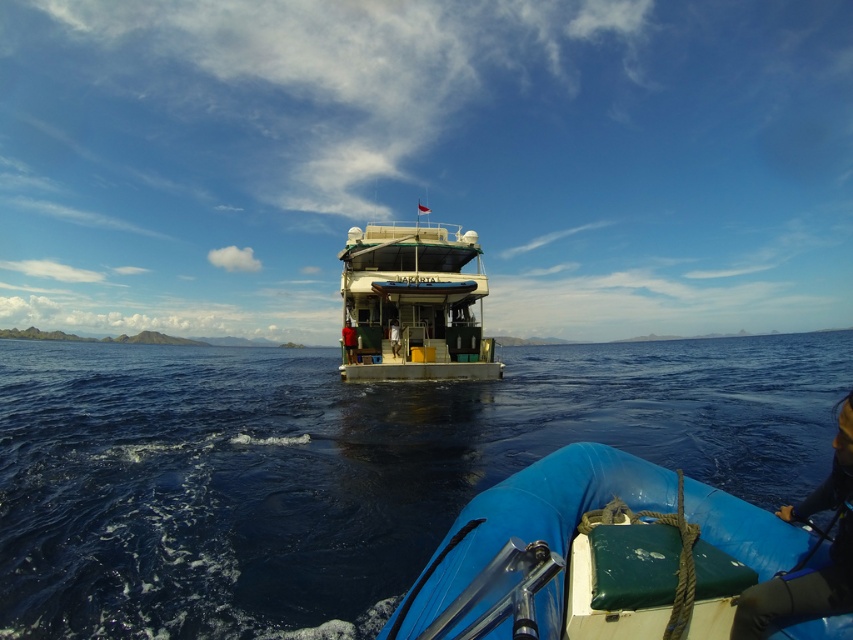
Does blue rubber boat at lower center appear on the right side of white glossy boat at center?

Indeed, blue rubber boat at lower center is positioned on the right side of white glossy boat at center.

The width and height of the screenshot is (853, 640). I want to click on blue rubber boat at lower center, so point(538,513).

Which is in front, point (418, 604) or point (386, 364)?

Point (418, 604)

Locate an element on the screen. This screenshot has height=640, width=853. blue rubber boat at lower center is located at coordinates (538, 513).

Which is above, blue water at center or blue rubber boat at lower center?

blue rubber boat at lower center is above.

Does point (218, 406) lie behind point (541, 506)?

Yes, it is behind point (541, 506).

Is point (219, 616) positioned in front of point (633, 484)?

No.

The width and height of the screenshot is (853, 640). Find the location of `blue water at center`. blue water at center is located at coordinates (341, 467).

From the picture: Is blue water at center to the left of white glossy boat at center from the viewer's perspective?

Indeed, blue water at center is positioned on the left side of white glossy boat at center.

Can you confirm if blue water at center is taller than white glossy boat at center?

No, blue water at center is not taller than white glossy boat at center.

At what (x,y) coordinates should I click in order to perform the action: click on blue water at center. Please return your answer as a coordinate pair (x, y). The image size is (853, 640). Looking at the image, I should click on (341, 467).

The width and height of the screenshot is (853, 640). Find the location of `blue water at center`. blue water at center is located at coordinates (341, 467).